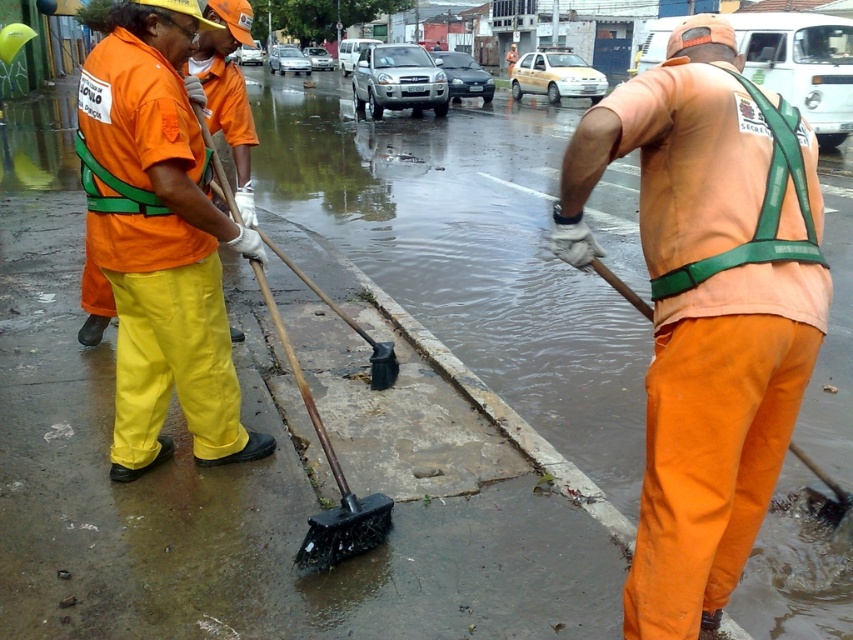
Is wet concrete sidewalk at lower center shorter than orange matte shirt at center?

No.

Looking at this image, is wet concrete sidewalk at lower center to the right of orange matte shirt at center from the viewer's perspective?

Indeed, wet concrete sidewalk at lower center is positioned on the right side of orange matte shirt at center.

Who is more forward, (809, 413) or (677, 561)?

Point (677, 561)

This screenshot has height=640, width=853. I want to click on wet concrete sidewalk at lower center, so click(468, 252).

Does matte orange shirt at center have a lesser width compared to green fabric safety vest at right?

Incorrect, matte orange shirt at center's width is not less than green fabric safety vest at right's.

Who is shorter, matte orange shirt at center or green fabric safety vest at right?

With less height is green fabric safety vest at right.

Locate an element on the screen. Image resolution: width=853 pixels, height=640 pixels. matte orange shirt at center is located at coordinates (161, 243).

Is orange matte shirt at center wider than green fabric safety vest at right?

Yes, orange matte shirt at center is wider than green fabric safety vest at right.

Who is more forward, (x=654, y=364) or (x=749, y=288)?

Point (x=749, y=288) is more forward.

You are a GUI agent. You are given a task and a screenshot of the screen. Output one action in this format:
    pyautogui.click(x=<x>, y=<y>)
    Task: Click on the orange matte shirt at center
    
    Given the screenshot: What is the action you would take?
    pyautogui.click(x=706, y=308)

Locate an element on the screen. The height and width of the screenshot is (640, 853). orange matte shirt at center is located at coordinates (706, 308).